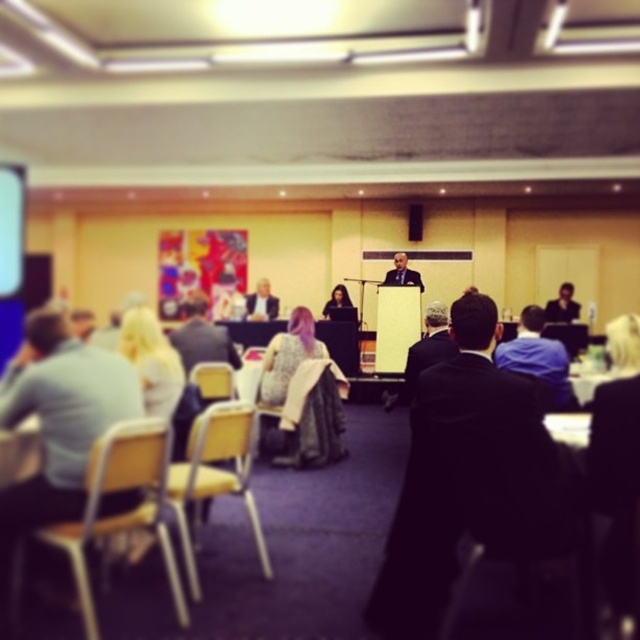
Question: Based on their relative distances, which object is nearer to the wooden chair at center?

Choices:
 (A) smooth beige suit at center
 (B) black suit coat at center
 (C) wooden chair at lower left

Answer: (B)

Question: Does wooden chair at center appear on the right side of smooth black suit at right?

Choices:
 (A) no
 (B) yes

Answer: (A)

Question: Estimate the real-world distances between objects in this image. Which object is farther from the black suit coat at center?

Choices:
 (A) dark gray suit at center
 (B) blue glossy projection screen at left
 (C) yellow plastic chair at lower left

Answer: (B)

Question: Does black suit coat at center have a greater width compared to formal suit at center?

Choices:
 (A) no
 (B) yes

Answer: (B)

Question: Which of the following is the closest to the observer?

Choices:
 (A) (396, 259)
 (B) (6, 292)
 (C) (332, 403)

Answer: (C)

Question: Can you confirm if blonde hair at left is wider than matte black dress at center?

Choices:
 (A) no
 (B) yes

Answer: (A)